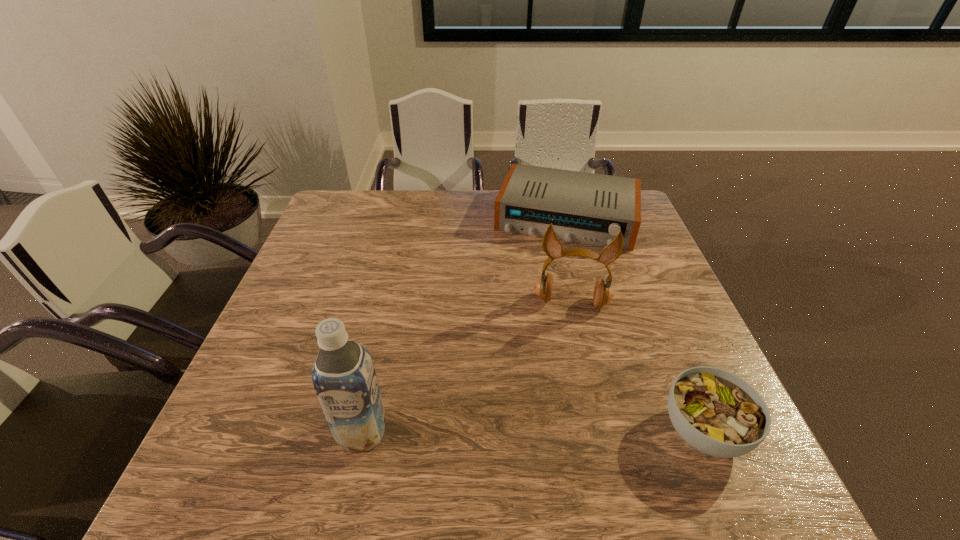
Locate an element on the screen. The height and width of the screenshot is (540, 960). soya milk is located at coordinates (344, 378).

What are the coordinates of `the tallest object` in the screenshot? It's located at (344, 378).

The image size is (960, 540). In order to click on soup bowl in this screenshot , I will do `click(716, 412)`.

In order to click on the second farthest object in this screenshot , I will do `click(603, 294)`.

I want to click on the third shortest object, so click(603, 294).

The width and height of the screenshot is (960, 540). In order to click on radio receiver in this screenshot , I will do `click(589, 208)`.

Identify the location of vacant space located on the left of the soup bowl. (566, 431).

Image resolution: width=960 pixels, height=540 pixels. Identify the location of vacant region located 0.200m on the front-facing side of the third nearest object. (566, 383).

Identify the location of free region located 0.240m on the front-facing side of the third nearest object. Image resolution: width=960 pixels, height=540 pixels. (565, 399).

Where is `free space located 0.280m on the front-facing side of the third nearest object`? Image resolution: width=960 pixels, height=540 pixels. free space located 0.280m on the front-facing side of the third nearest object is located at coordinates (565, 416).